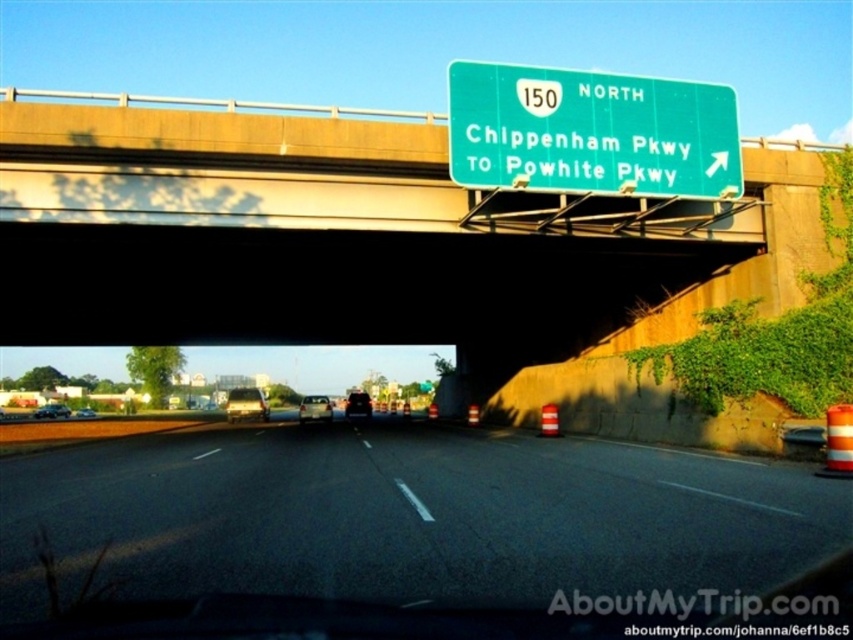
You are driving a car and see the green metallic sign at upper center and the metallic silver sedan at center ahead. If you want to reach the sign before the sedan does, what should you do?

The green metallic sign at upper center is 54.84 meters away from the metallic silver sedan at center. To reach the sign before the sedan, you need to accelerate or change lanes to overtake the sedan before the sign.

Based on the photo, you are driving a car and see the black asphalt highway at center and the silver metallic sedan at center ahead. Which one is wider?

The black asphalt highway at center is wider than the silver metallic sedan at center.

You are driving a car and see both the black matte car at center and the silver metallic sedan at center on the highway. Which one is positioned more to the right side of the road?

The black matte car at center is positioned more to the right side of the road than the silver metallic sedan at center.